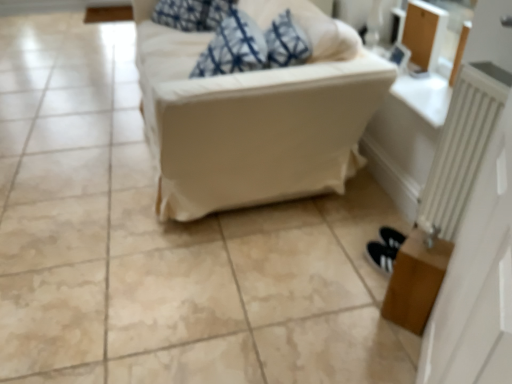
Locate an element on the screen. The image size is (512, 384). free location in front of brown wooden table at lower right is located at coordinates (393, 350).